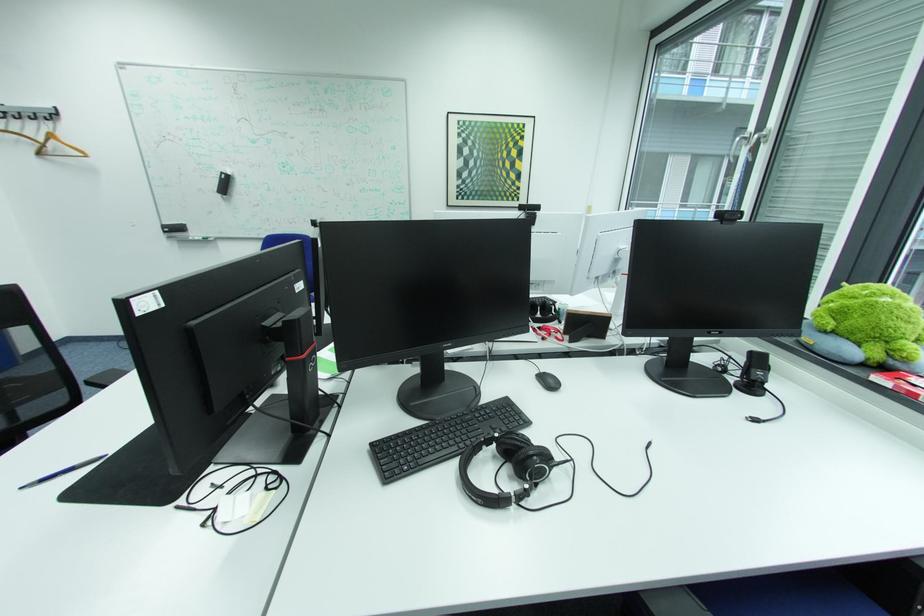
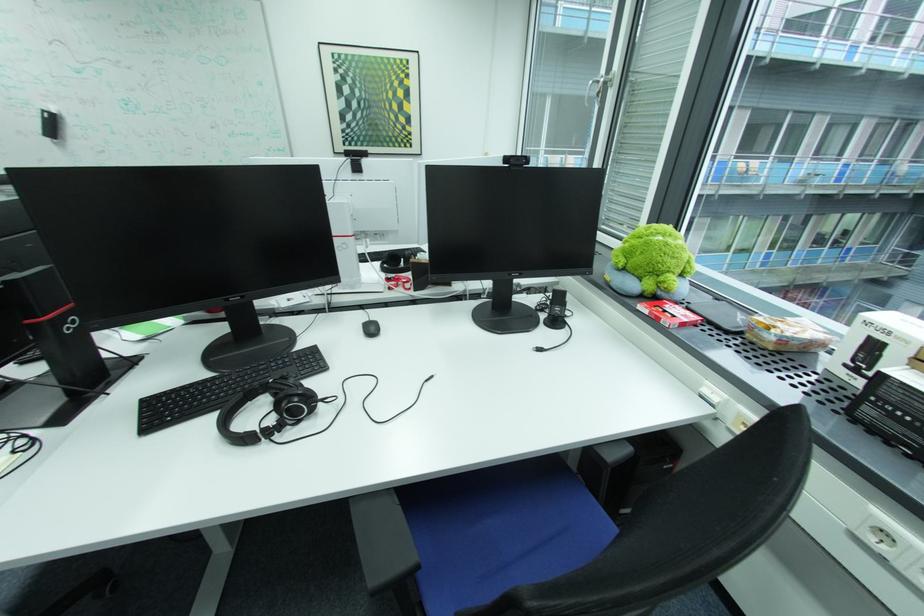
Question: What movement of the cameraman would produce the second image?

Choices:
 (A) Left
 (B) Right
 (C) Forward
 (D) Backward

Answer: (B)